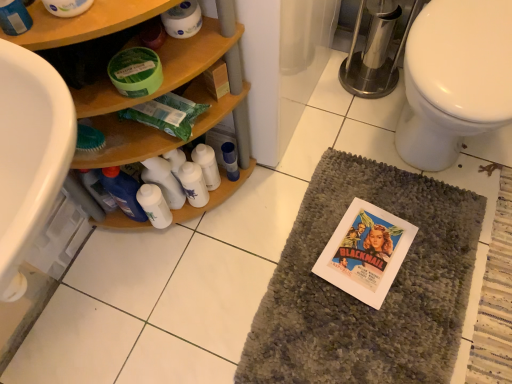
Question: Is gray textured bath mat at center far away from blue glossy bottle at center, the second bottle from the left?

Choices:
 (A) yes
 (B) no

Answer: (B)

Question: Is gray textured bath mat at center oriented away from blue glossy bottle at center, the second bottle from the left?

Choices:
 (A) no
 (B) yes

Answer: (A)

Question: Does gray textured bath mat at center have a greater height compared to blue glossy bottle at center, the first bottle positioned from the right?

Choices:
 (A) no
 (B) yes

Answer: (A)

Question: Can you confirm if gray textured bath mat at center is wider than blue glossy bottle at center, the first bottle positioned from the right?

Choices:
 (A) yes
 (B) no

Answer: (A)

Question: Does gray textured bath mat at center have a lesser width compared to blue glossy bottle at center, the second bottle from the left?

Choices:
 (A) yes
 (B) no

Answer: (B)

Question: Is gray textured bath mat at center positioned in front of blue glossy bottle at center, the second bottle from the left?

Choices:
 (A) no
 (B) yes

Answer: (B)

Question: Are white glossy bottles at center, the first toiletry positioned from the right, and blue glossy bottle at center, the second bottle from the left, far apart?

Choices:
 (A) yes
 (B) no

Answer: (B)

Question: Does white glossy bottles at center, the second toiletry in the left-to-right sequence, come behind blue glossy bottle at center, the first bottle positioned from the right?

Choices:
 (A) no
 (B) yes

Answer: (A)

Question: From a real-world perspective, is white glossy bottles at center, the second toiletry in the left-to-right sequence, over blue glossy bottle at center, the second bottle from the left?

Choices:
 (A) no
 (B) yes

Answer: (B)

Question: Is white glossy bottles at center, the second toiletry in the left-to-right sequence, outside blue glossy bottle at center, the first bottle positioned from the right?

Choices:
 (A) yes
 (B) no

Answer: (A)

Question: Is white glossy bottles at center, the second toiletry in the left-to-right sequence, next to blue glossy bottle at center, the first bottle positioned from the right, and touching it?

Choices:
 (A) yes
 (B) no

Answer: (B)

Question: Is blue glossy bottle at center, the first bottle positioned from the right, inside white glossy bottles at center, the first toiletry positioned from the right?

Choices:
 (A) no
 (B) yes

Answer: (A)

Question: Does white paper comic book at center have a greater width compared to white matte toilet paper at upper center?

Choices:
 (A) no
 (B) yes

Answer: (B)